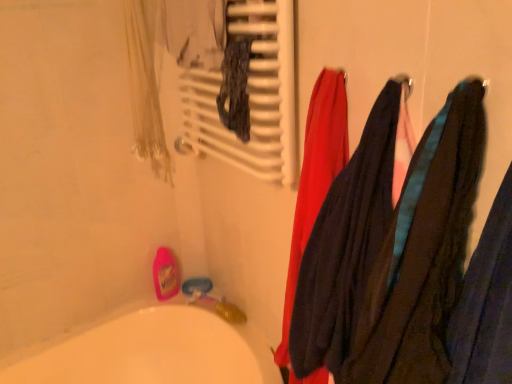
Locate an element on the screen. The width and height of the screenshot is (512, 384). dark blue fabric at right is located at coordinates (422, 252).

The image size is (512, 384). Describe the element at coordinates (422, 252) in the screenshot. I see `dark blue fabric at right` at that location.

Measure the distance between dark blue fabric at right and camera.

The depth of dark blue fabric at right is 22.61 inches.

What is the approximate width of dark blue fabric at right?

dark blue fabric at right is 7.68 inches in width.

Based on the photo, what is the approximate width of white matte radiator at upper center?

white matte radiator at upper center is 3.22 inches wide.

Find the location of a particular element. This screenshot has height=384, width=512. white matte radiator at upper center is located at coordinates (250, 95).

Describe the element at coordinates (250, 95) in the screenshot. I see `white matte radiator at upper center` at that location.

Where is `dark blue fabric at right`? dark blue fabric at right is located at coordinates (422, 252).

Looking at this image, does white matte radiator at upper center appear on the left side of dark blue fabric at right?

Yes.

Is white matte radiator at upper center positioned in front of dark blue fabric at right?

No, it is not.

In the scene shown: Which is less distant, (208, 110) or (388, 376)?

Point (388, 376)

From the image's perspective, would you say white matte radiator at upper center is positioned over dark blue fabric at right?

Indeed, from the image's perspective, white matte radiator at upper center is shown above dark blue fabric at right.

From a real-world perspective, is white matte radiator at upper center positioned above or below dark blue fabric at right?

Clearly, from a real-world perspective, white matte radiator at upper center is above dark blue fabric at right.

Between white matte radiator at upper center and dark blue fabric at right, which one has smaller width?

Thinner between the two is white matte radiator at upper center.

Considering the relative sizes of white matte radiator at upper center and dark blue fabric at right in the image provided, is white matte radiator at upper center taller than dark blue fabric at right?

In fact, white matte radiator at upper center may be shorter than dark blue fabric at right.

Does white matte radiator at upper center have a smaller size compared to dark blue fabric at right?

No.

Is white matte radiator at upper center spatially inside dark blue fabric at right, or outside of it?

white matte radiator at upper center is located beyond the bounds of dark blue fabric at right.

Are white matte radiator at upper center and dark blue fabric at right far apart?

No, white matte radiator at upper center is in close proximity to dark blue fabric at right.

Looking at this image, is white matte radiator at upper center turned away from dark blue fabric at right?

white matte radiator at upper center does not have its back to dark blue fabric at right.

Measure the distance between white matte radiator at upper center and dark blue fabric at right.

They are 17.00 inches apart.

Locate an element on the screen. Image resolution: width=512 pixels, height=384 pixels. radiator that is above the dark blue fabric at right (from a real-world perspective) is located at coordinates (250, 95).

Is dark blue fabric at right to the left or to the right of white matte radiator at upper center in the image?

From the image, it's evident that dark blue fabric at right is to the right of white matte radiator at upper center.

Which is behind, dark blue fabric at right or white matte radiator at upper center?

white matte radiator at upper center is more distant.

Which is further, (451, 122) or (211, 76)?

Positioned behind is point (211, 76).

From the image's perspective, is dark blue fabric at right above or below white matte radiator at upper center?

Clearly, from the image's perspective, dark blue fabric at right is below white matte radiator at upper center.

From a real-world perspective, who is located lower, dark blue fabric at right or white matte radiator at upper center?

dark blue fabric at right, from a real-world perspective.

Considering the relative sizes of dark blue fabric at right and white matte radiator at upper center in the image provided, is dark blue fabric at right thinner than white matte radiator at upper center?

No, dark blue fabric at right is not thinner than white matte radiator at upper center.

Who is taller, dark blue fabric at right or white matte radiator at upper center?

With more height is dark blue fabric at right.

Between dark blue fabric at right and white matte radiator at upper center, which one has larger size?

white matte radiator at upper center is bigger.

Is dark blue fabric at right positioned beyond the bounds of white matte radiator at upper center?

That's correct, dark blue fabric at right is outside of white matte radiator at upper center.

Is dark blue fabric at right positioned far away from white matte radiator at upper center?

dark blue fabric at right is actually quite close to white matte radiator at upper center.

Is dark blue fabric at right turned away from white matte radiator at upper center?

No.

This screenshot has height=384, width=512. I want to click on radiator above the dark blue fabric at right (from the image's perspective), so click(250, 95).

Where is `towel in front of the white matte radiator at upper center`? The width and height of the screenshot is (512, 384). towel in front of the white matte radiator at upper center is located at coordinates (422, 252).

The width and height of the screenshot is (512, 384). What are the coordinates of `towel below the white matte radiator at upper center (from the image's perspective)` in the screenshot? It's located at (422, 252).